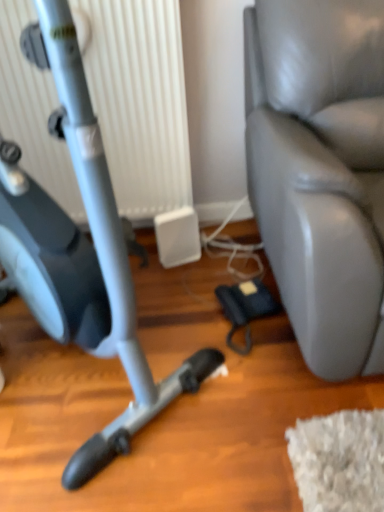
The image size is (384, 512). I want to click on leather swivel chair at right, so click(x=321, y=172).

You are a GUI agent. You are given a task and a screenshot of the screen. Output one action in this format:
    pyautogui.click(x=<x>, y=<y>)
    Task: Click on the matte gray stationary bicycle at left
    The image size is (384, 512).
    Given the screenshot: What is the action you would take?
    pyautogui.click(x=81, y=252)

The width and height of the screenshot is (384, 512). What are the coordinates of `white plastic radiator at upper left` in the screenshot? It's located at (139, 100).

At what (x,y) coordinates should I click in order to perform the action: click on stationary bicycle that is in front of the white plastic radiator at upper left. Please return your answer as a coordinate pair (x, y). This screenshot has width=384, height=512. Looking at the image, I should click on (81, 252).

In the scene shown: How different are the orientations of matte gray stationary bicycle at left and white plastic radiator at upper left in degrees?

matte gray stationary bicycle at left and white plastic radiator at upper left are facing 40.4 degrees away from each other.

Considering their positions, is matte gray stationary bicycle at left located in front of or behind white plastic radiator at upper left?

Visually, matte gray stationary bicycle at left is located in front of white plastic radiator at upper left.

Considering the relative positions of leather swivel chair at right and matte gray stationary bicycle at left in the image provided, is leather swivel chair at right behind matte gray stationary bicycle at left?

Yes, it is behind matte gray stationary bicycle at left.

Considering the relative sizes of leather swivel chair at right and matte gray stationary bicycle at left in the image provided, is leather swivel chair at right smaller than matte gray stationary bicycle at left?

No.

Which object is positioned more to the left, leather swivel chair at right or matte gray stationary bicycle at left?

matte gray stationary bicycle at left is more to the left.

Is matte gray stationary bicycle at left at the back of leather swivel chair at right?

No, leather swivel chair at right's orientation is not away from matte gray stationary bicycle at left.

From a real-world perspective, is matte gray stationary bicycle at left above or below leather swivel chair at right?

In terms of real-world spatial position, matte gray stationary bicycle at left is above leather swivel chair at right.

Considering their positions, is matte gray stationary bicycle at left located in front of or behind leather swivel chair at right?

matte gray stationary bicycle at left is in front of leather swivel chair at right.

Which object is thinner, matte gray stationary bicycle at left or leather swivel chair at right?

Thinner between the two is matte gray stationary bicycle at left.

I want to click on swivel chair lying on the right of matte gray stationary bicycle at left, so click(x=321, y=172).

Can white plastic radiator at upper left be found inside leather swivel chair at right?

No, white plastic radiator at upper left is not inside leather swivel chair at right.

Which point is more distant from viewer, [268,218] or [114,69]?

Point [114,69]

Could you tell me if leather swivel chair at right is facing white plastic radiator at upper left?

No, leather swivel chair at right is not oriented towards white plastic radiator at upper left.

Where is `radiator behind the leather swivel chair at right`? radiator behind the leather swivel chair at right is located at coordinates pos(139,100).

From the image's perspective, is white plastic radiator at upper left located above or below matte gray stationary bicycle at left?

From the image's perspective, white plastic radiator at upper left appears above matte gray stationary bicycle at left.

How different are the orientations of white plastic radiator at upper left and matte gray stationary bicycle at left in degrees?

white plastic radiator at upper left and matte gray stationary bicycle at left are facing 40.4 degrees away from each other.

Does white plastic radiator at upper left have a smaller size compared to matte gray stationary bicycle at left?

Yes, white plastic radiator at upper left is smaller than matte gray stationary bicycle at left.

Identify the location of stationary bicycle that appears in front of the white plastic radiator at upper left. (81, 252).

In terms of size, does white plastic radiator at upper left appear bigger or smaller than leather swivel chair at right?

Considering their sizes, white plastic radiator at upper left takes up less space than leather swivel chair at right.

Is point (82, 27) closer to camera compared to point (380, 334)?

No, (82, 27) is behind (380, 334).

Considering the sizes of objects white plastic radiator at upper left and leather swivel chair at right in the image provided, who is taller, white plastic radiator at upper left or leather swivel chair at right?

leather swivel chair at right is taller.

The image size is (384, 512). Find the location of `stationary bicycle located in front of the white plastic radiator at upper left`. stationary bicycle located in front of the white plastic radiator at upper left is located at coordinates (81, 252).

The height and width of the screenshot is (512, 384). Identify the location of stationary bicycle below the leather swivel chair at right (from the image's perspective). tap(81, 252).

Looking at the image, which one is located further to matte gray stationary bicycle at left, leather swivel chair at right or white plastic radiator at upper left?

white plastic radiator at upper left.

Which object lies further to the anchor point leather swivel chair at right, matte gray stationary bicycle at left or white plastic radiator at upper left?

matte gray stationary bicycle at left is further to leather swivel chair at right.

When comparing their distances from matte gray stationary bicycle at left, does white plastic radiator at upper left or leather swivel chair at right seem closer?

leather swivel chair at right.

From the image, which object appears to be nearer to white plastic radiator at upper left, matte gray stationary bicycle at left or leather swivel chair at right?

leather swivel chair at right is closer to white plastic radiator at upper left.

From the image, which object appears to be nearer to leather swivel chair at right, white plastic radiator at upper left or matte gray stationary bicycle at left?

white plastic radiator at upper left is closer to leather swivel chair at right.

Looking at the image, which one is located closer to white plastic radiator at upper left, leather swivel chair at right or matte gray stationary bicycle at left?

Based on the image, leather swivel chair at right appears to be nearer to white plastic radiator at upper left.

In order to click on radiator between matte gray stationary bicycle at left and leather swivel chair at right in the horizontal direction in this screenshot , I will do `click(139, 100)`.